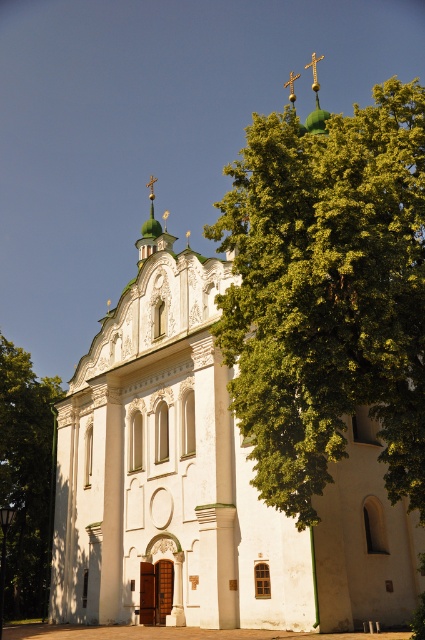
You are a photographer planning to take a picture of the gold metallic cross at upper center. You notice the green leafy tree at upper right might be blocking the view. Based on their sizes, is there a chance the tree could cover part of the cross in the photo?

The green leafy tree at upper right might be wider than gold metallic cross at upper center, so there is a possibility that the tree could partially obscure the cross in the photo.

You are a photographer aiming to capture the gold metallic cross at upper center without any obstructions. Given the green leafy tree at left, is there a way to adjust your position to avoid the tree blocking the view?

The green leafy tree at left is positioned under the gold metallic cross at upper center, so moving your camera position higher or to the right should allow you to frame the gold metallic cross at upper center without obstruction from the tree.

You are standing in front of the historic church and want to take a photo that includes both the green leafy tree at upper right and the green leafy tree at left. Which tree is closer to the camera?

The green leafy tree at upper right is positioned over the green leafy tree at left, meaning it is closer to the camera.